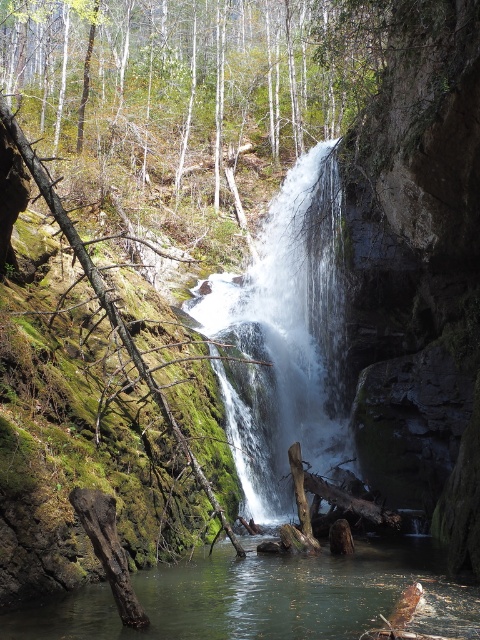
Is point (272, 522) positioned before point (144, 579)?

No.

Is white frothy water at center wider than clear water at center?

In fact, white frothy water at center might be narrower than clear water at center.

Which is behind, point (327, 225) or point (48, 627)?

Positioned behind is point (327, 225).

Where is `white frothy water at center`? The width and height of the screenshot is (480, 640). white frothy water at center is located at coordinates (285, 339).

Does green mossy tree at center have a lesser width compared to white frothy water at center?

Incorrect, green mossy tree at center's width is not less than white frothy water at center's.

Between green mossy tree at center and white frothy water at center, which one appears on the left side from the viewer's perspective?

green mossy tree at center

Is point (180, 157) in front of point (312, 164)?

No, it is not.

The image size is (480, 640). In order to click on green mossy tree at center in this screenshot , I will do `click(188, 76)`.

Does point (98, 152) come closer to viewer compared to point (49, 608)?

No, (98, 152) is behind (49, 608).

Is point (45, 88) positioned before point (340, 609)?

That is False.

Find the location of a particular element. green mossy tree at center is located at coordinates (188, 76).